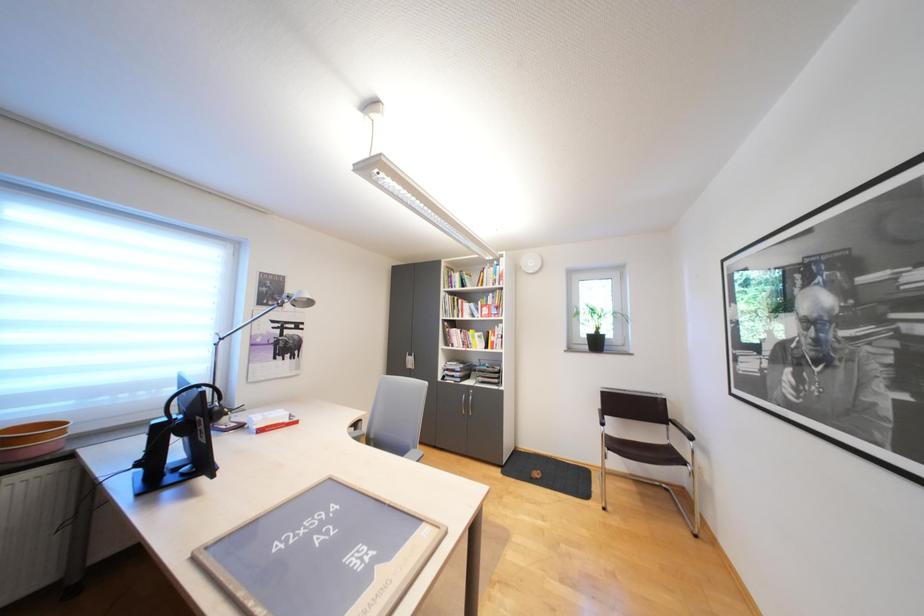
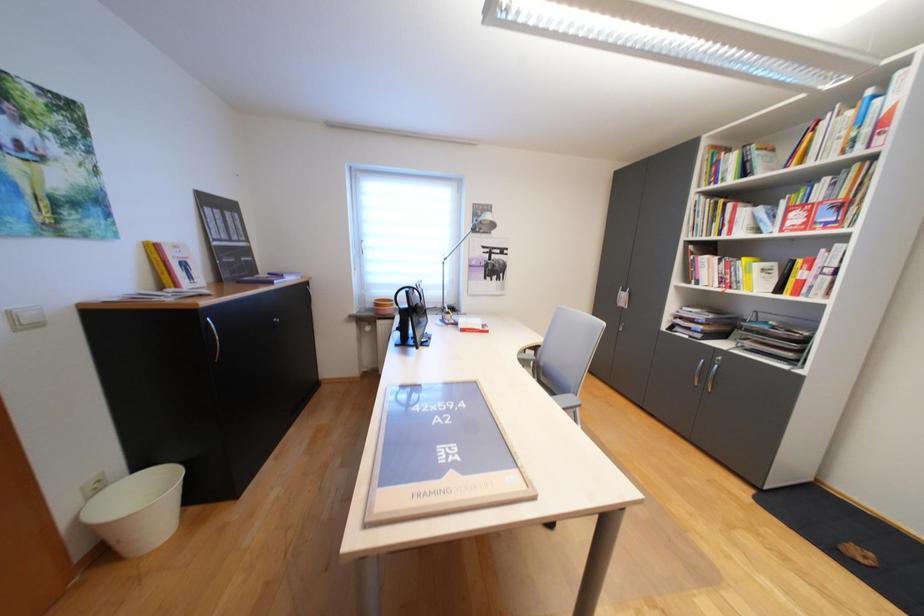
Question: The camera is either moving clockwise (left) or counter-clockwise (right) around the object. The first image is from the beginning of the video and the second image is from the end. Is the camera moving left or right when shooting the video?

Choices:
 (A) Left
 (B) Right

Answer: (B)